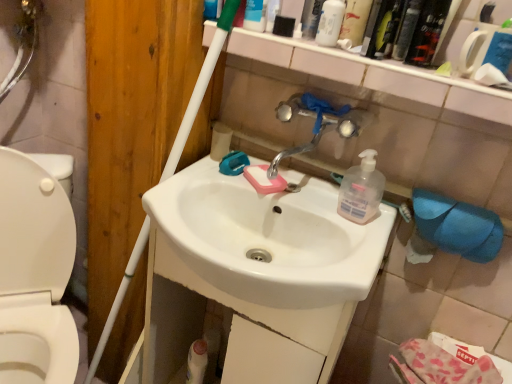
Where is `empty space that is to the right of white plastic bottle at upper center, marked as the second toiletry in a right-to-left arrangement`? The width and height of the screenshot is (512, 384). empty space that is to the right of white plastic bottle at upper center, marked as the second toiletry in a right-to-left arrangement is located at coordinates (311, 44).